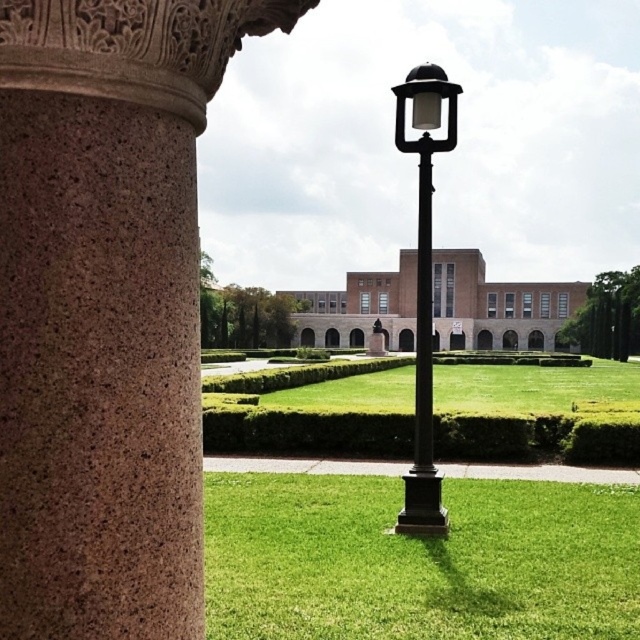
Question: Is brown speckled stone column at left smaller than black polished metal lamp post at center?

Choices:
 (A) yes
 (B) no

Answer: (A)

Question: Estimate the real-world distances between objects in this image. Which object is closer to the black polished metal lamp post at center?

Choices:
 (A) brown speckled stone column at left
 (B) green grass at center

Answer: (A)

Question: Considering the real-world distances, which object is farthest from the brown speckled stone column at left?

Choices:
 (A) black polished metal lamp post at center
 (B) green grass at center

Answer: (A)

Question: Is green grass at center to the right of black polished metal lamp post at center from the viewer's perspective?

Choices:
 (A) yes
 (B) no

Answer: (B)

Question: Does brown speckled stone column at left come behind black polished metal lamp post at center?

Choices:
 (A) yes
 (B) no

Answer: (B)

Question: Based on their relative distances, which object is nearer to the black polished metal lamp post at center?

Choices:
 (A) brown speckled stone column at left
 (B) green grass at center

Answer: (A)